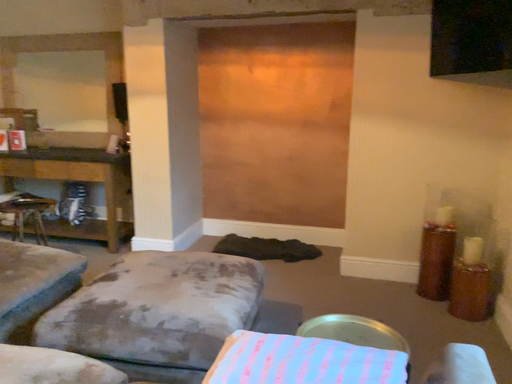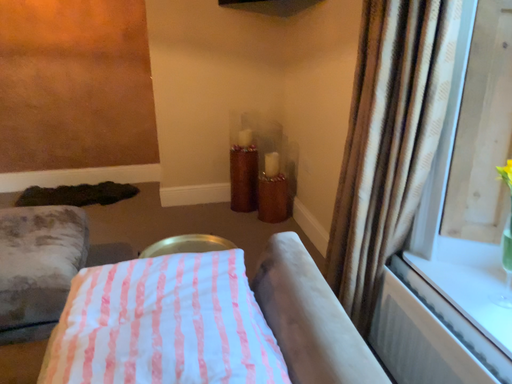
Question: How did the camera likely rotate when shooting the video?

Choices:
 (A) rotated left
 (B) rotated right

Answer: (B)